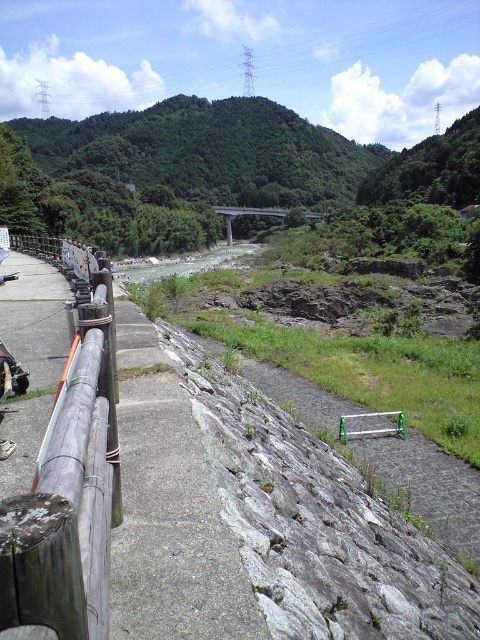
You are a hiker who wants to cross the gray concrete path at center and the clear water at center. Which one has a larger area?

The clear water at center has a larger area than the gray concrete path at center.

You are standing on the pathway and want to look at both the brown wood rail at left and the clear water at center. Which object will appear larger in your view?

The brown wood rail at left appears larger because it is closer to the viewer than the clear water at center.